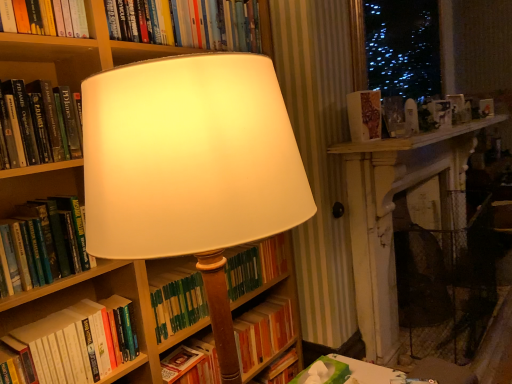
Question: From their relative heights in the image, would you say green hardcover book at center, which appears as the seventh book when viewed from the top, is taller or shorter than green matte book at center, which is counted as the 3th book, starting from the bottom?

Choices:
 (A) tall
 (B) short

Answer: (A)

Question: From a real-world perspective, is green hardcover book at center, which is the 1th book in bottom-to-top order, positioned above or below green matte book at center, which is counted as the 3th book, starting from the bottom?

Choices:
 (A) below
 (B) above

Answer: (A)

Question: Based on their relative distances, which object is nearer to the blue lights at upper right?

Choices:
 (A) hardcover book at left, acting as the fifth book starting from the bottom
 (B) green matte book at center, which is counted as the 3th book, starting from the bottom
 (C) hardcover book at left, positioned as the 6th book in top-to-bottom order
 (D) patterned paper book at upper right, marked as the 6th book in a bottom-to-top arrangement
 (E) hardcover book at upper center, arranged as the first book when viewed from the top

Answer: (D)

Question: Which object is the farthest from the blue lights at upper right?

Choices:
 (A) hardcover book at left, positioned as the 6th book in top-to-bottom order
 (B) hardcover book at left, which appears as the third book when viewed from the top
 (C) hardcover book at upper center, arranged as the first book when viewed from the top
 (D) hardcover book at left, which is the 4th book in bottom-to-top order
 (E) patterned paper book at upper right, marked as the 6th book in a bottom-to-top arrangement

Answer: (A)